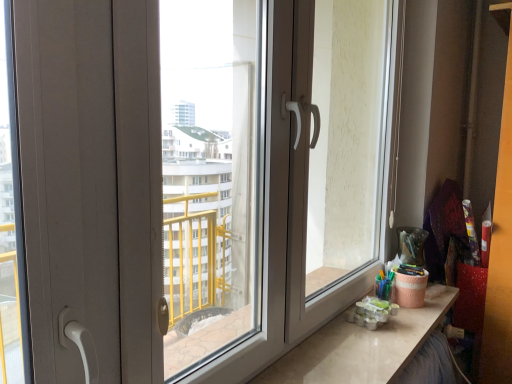
What do you see at coordinates (211, 175) in the screenshot? I see `transparent plastic window screen at center` at bounding box center [211, 175].

The width and height of the screenshot is (512, 384). I want to click on transparent plastic window screen at center, so click(x=211, y=175).

This screenshot has width=512, height=384. Find the location of `matte white counter top at lower right`. matte white counter top at lower right is located at coordinates (360, 348).

Image resolution: width=512 pixels, height=384 pixels. What are the coordinates of `matte white screen door at right` in the screenshot? It's located at (338, 155).

Find the location of `transparent plastic window screen at center`. transparent plastic window screen at center is located at coordinates (211, 175).

Between transparent plastic window screen at center and matte white counter top at lower right, which one has smaller width?

transparent plastic window screen at center is thinner.

Is transparent plastic window screen at center looking in the opposite direction of matte white counter top at lower right?

transparent plastic window screen at center is not turned away from matte white counter top at lower right.

How many degrees apart are the facing directions of transparent plastic window screen at center and matte white counter top at lower right?

0.581 degrees separate the facing orientations of transparent plastic window screen at center and matte white counter top at lower right.

Is transparent plastic window screen at center shorter than matte white counter top at lower right?

Incorrect, the height of transparent plastic window screen at center does not fall short of that of matte white counter top at lower right.

Which object is closer to the camera taking this photo, matte white screen door at right or matte white counter top at lower right?

Positioned in front is matte white counter top at lower right.

Which is more to the left, matte white screen door at right or matte white counter top at lower right?

matte white screen door at right.

Is matte white counter top at lower right at the back of matte white screen door at right?

No, matte white screen door at right is not facing the opposite direction of matte white counter top at lower right.

From a real-world perspective, which is physically above, matte white screen door at right or matte white counter top at lower right?

In real-world perspective, matte white screen door at right is above.

The image size is (512, 384). In order to click on counter top below the matte white screen door at right (from a real-world perspective) in this screenshot , I will do `click(360, 348)`.

Is matte white counter top at lower right taller than matte white screen door at right?

No.

Between matte white counter top at lower right and matte white screen door at right, which one has smaller width?

matte white screen door at right.

Is there a large distance between matte white counter top at lower right and matte white screen door at right?

No, matte white counter top at lower right is not far from matte white screen door at right.

In terms of width, does matte white counter top at lower right look wider or thinner when compared to transparent plastic window screen at center?

Considering their sizes, matte white counter top at lower right looks broader than transparent plastic window screen at center.

Does matte white counter top at lower right contain transparent plastic window screen at center?

Actually, transparent plastic window screen at center is outside matte white counter top at lower right.

From a real-world perspective, is matte white counter top at lower right physically above transparent plastic window screen at center?

No, from a real-world perspective, matte white counter top at lower right is not on top of transparent plastic window screen at center.

From the image's perspective, is matte white counter top at lower right under transparent plastic window screen at center?

Indeed, from the image's perspective, matte white counter top at lower right is shown beneath transparent plastic window screen at center.

Which is more to the right, matte white screen door at right or transparent plastic window screen at center?

From the viewer's perspective, matte white screen door at right appears more on the right side.

Does point (295, 229) come closer to viewer compared to point (220, 88)?

Yes, point (295, 229) is closer to viewer.

The image size is (512, 384). In the image, there is a matte white screen door at right. In order to click on window screen below it (from a real-world perspective) in this screenshot , I will do pos(211,175).

From the image's perspective, which is below, matte white screen door at right or transparent plastic window screen at center?

transparent plastic window screen at center.

From a real-world perspective, which is physically below, transparent plastic window screen at center or matte white screen door at right?

transparent plastic window screen at center is physically lower.

Does transparent plastic window screen at center have a greater height compared to matte white screen door at right?

Incorrect, the height of transparent plastic window screen at center is not larger of that of matte white screen door at right.

Is point (233, 129) closer to viewer compared to point (369, 130)?

No, it is not.

Does transparent plastic window screen at center turn towards matte white screen door at right?

No, transparent plastic window screen at center does not turn towards matte white screen door at right.

Locate an element on the screen. counter top below the transparent plastic window screen at center (from a real-world perspective) is located at coordinates (360, 348).

Find the location of a particular element. screen door on the left of matte white counter top at lower right is located at coordinates (338, 155).

Looking at the image, which one is located closer to matte white screen door at right, transparent plastic window screen at center or matte white counter top at lower right?

Among the two, matte white counter top at lower right is located nearer to matte white screen door at right.

When comparing their distances from matte white counter top at lower right, does matte white screen door at right or transparent plastic window screen at center seem further?

transparent plastic window screen at center is positioned further to the anchor matte white counter top at lower right.

From the image, which object appears to be nearer to matte white counter top at lower right, transparent plastic window screen at center or matte white screen door at right?

Among the two, matte white screen door at right is located nearer to matte white counter top at lower right.

From the image, which object appears to be farther from transparent plastic window screen at center, matte white screen door at right or matte white counter top at lower right?

matte white counter top at lower right.

Looking at the image, which one is located closer to matte white screen door at right, matte white counter top at lower right or transparent plastic window screen at center?

matte white counter top at lower right lies closer to matte white screen door at right than the other object.

Estimate the real-world distances between objects in this image. Which object is closer to transparent plastic window screen at center, matte white counter top at lower right or matte white screen door at right?

Among the two, matte white screen door at right is located nearer to transparent plastic window screen at center.

This screenshot has height=384, width=512. What are the coordinates of `window screen between matte white screen door at right and matte white counter top at lower right vertically` in the screenshot? It's located at (211, 175).